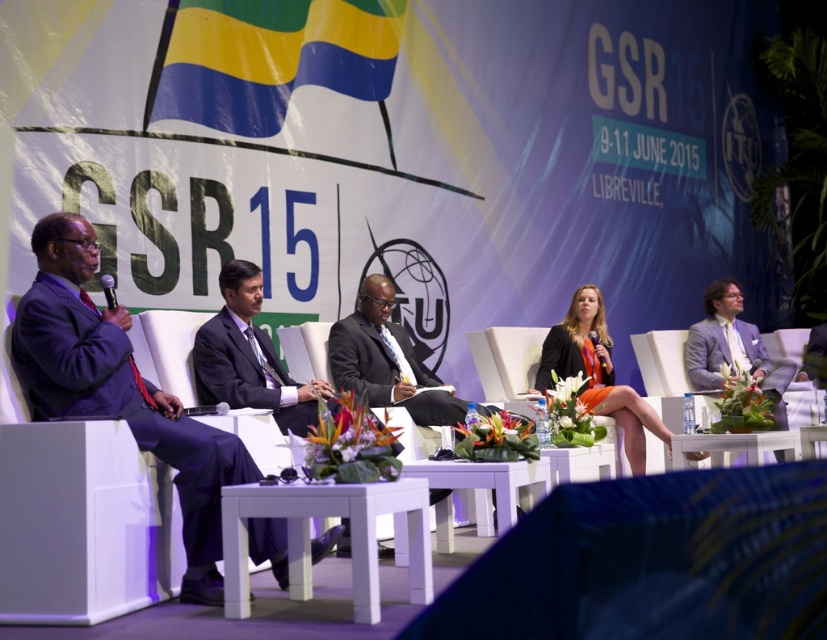
Question: Which object is the farthest from the matte black suit at left?

Choices:
 (A) metallic silver microphone at left
 (B) orange fabric dress at center
 (C) dark suit at center

Answer: (B)

Question: Estimate the real-world distances between objects in this image. Which object is farther from the matte black suit at left?

Choices:
 (A) orange fabric dress at center
 (B) dark suit at center
 (C) metallic silver microphone at left

Answer: (A)

Question: Which of the following is the farthest from the observer?

Choices:
 (A) (113, 305)
 (B) (373, 296)

Answer: (B)

Question: Is matte black suit at left to the left of orange fabric dress at center from the viewer's perspective?

Choices:
 (A) yes
 (B) no

Answer: (A)

Question: Can you confirm if matte black suit at left is wider than orange fabric dress at center?

Choices:
 (A) yes
 (B) no

Answer: (A)

Question: Can you confirm if dark suit at center is positioned to the left of metallic silver microphone at left?

Choices:
 (A) yes
 (B) no

Answer: (B)